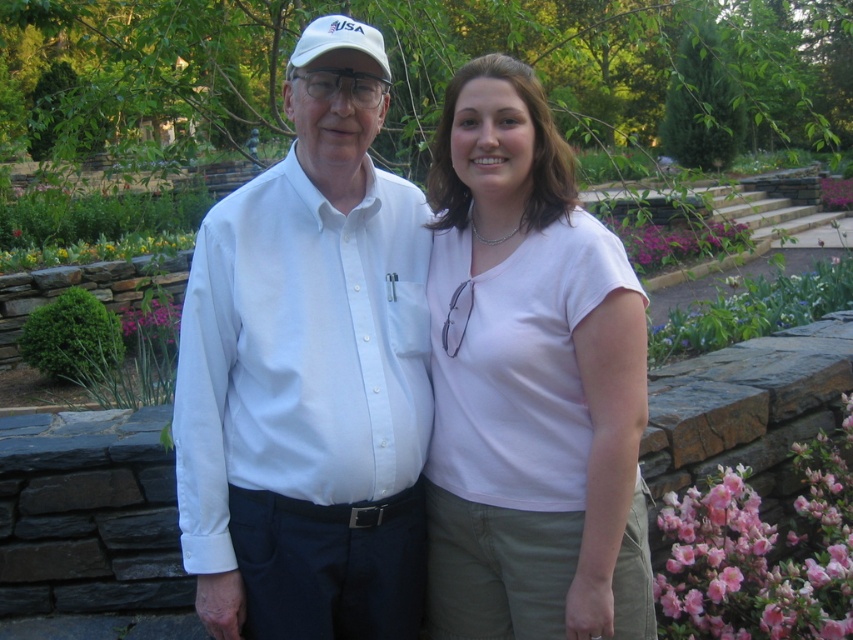
Can you confirm if white fabric baseball cap at upper center is positioned to the right of pink matte flower at center?

Indeed, white fabric baseball cap at upper center is positioned on the right side of pink matte flower at center.

Does white fabric baseball cap at upper center come in front of pink matte flower at center?

Yes, white fabric baseball cap at upper center is in front of pink matte flower at center.

Does point (332, 29) come in front of point (149, 332)?

Yes, point (332, 29) is in front of point (149, 332).

Where is `white fabric baseball cap at upper center`? Image resolution: width=853 pixels, height=640 pixels. white fabric baseball cap at upper center is located at coordinates (337, 42).

Between white smooth shirt at left and white matte shirt at center, which one has less height?

With less height is white smooth shirt at left.

Is white smooth shirt at left behind white matte shirt at center?

Yes, white smooth shirt at left is behind white matte shirt at center.

The height and width of the screenshot is (640, 853). What do you see at coordinates (308, 381) in the screenshot? I see `white smooth shirt at left` at bounding box center [308, 381].

Identify the location of white smooth shirt at left. point(308,381).

Which is in front, point (817, 492) or point (364, 36)?

Point (364, 36) is in front.

Where is `pink matte flower at lower right`? This screenshot has height=640, width=853. pink matte flower at lower right is located at coordinates (761, 554).